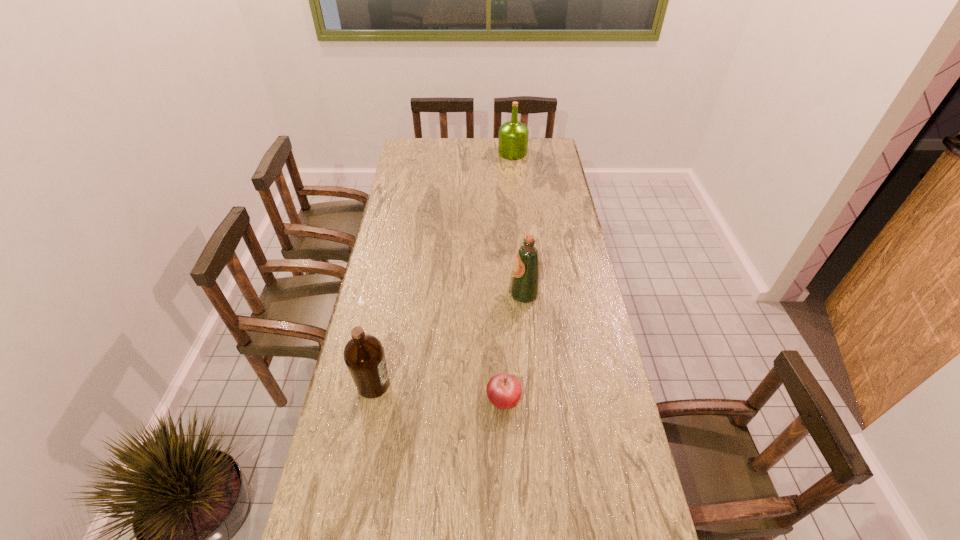
Find the location of a particular element. This screenshot has width=960, height=540. the farthest olive oil is located at coordinates (513, 135).

Locate an element on the screen. This screenshot has height=540, width=960. the second farthest olive oil is located at coordinates (524, 286).

Image resolution: width=960 pixels, height=540 pixels. What are the coordinates of `the leftmost olive oil` in the screenshot? It's located at point(364,356).

Locate an element on the screen. Image resolution: width=960 pixels, height=540 pixels. the leftmost object is located at coordinates (364, 356).

Where is `apple`? apple is located at coordinates (503, 390).

In order to click on vacant region located 0.350m on the front of the farthest object in this screenshot , I will do `click(517, 201)`.

Identify the location of free space located 0.390m on the front-facing side of the third nearest object. The image size is (960, 540). (398, 294).

You are a GUI agent. You are given a task and a screenshot of the screen. Output one action in this format:
    pyautogui.click(x=<x>, y=<y>)
    Task: Click on the free space located 0.260m on the front-facing side of the third nearest object
    
    Given the screenshot: What is the action you would take?
    pyautogui.click(x=435, y=294)

Where is `vacant space located 0.190m on the front-facing side of the third nearest object`? Image resolution: width=960 pixels, height=540 pixels. vacant space located 0.190m on the front-facing side of the third nearest object is located at coordinates (455, 294).

Locate an element on the screen. free space located on the label of the leftmost object is located at coordinates (429, 384).